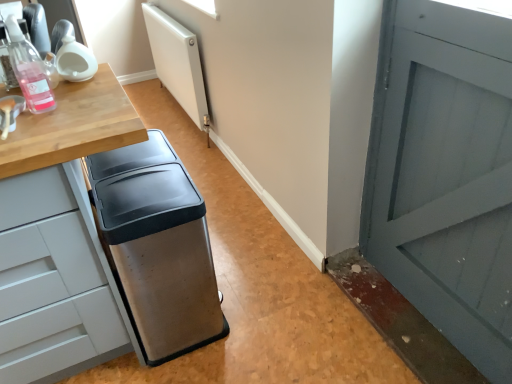
Where is `free space to the back side of translucent plastic bottle at left`? The width and height of the screenshot is (512, 384). free space to the back side of translucent plastic bottle at left is located at coordinates (73, 90).